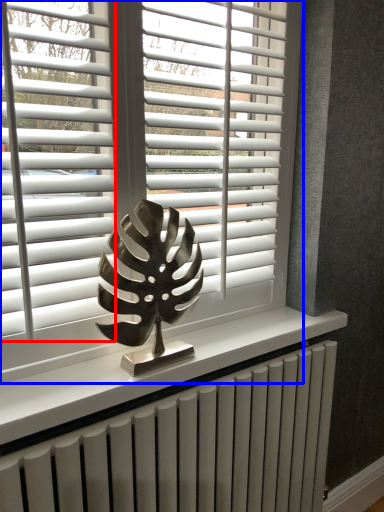
Question: Among these objects, which one is nearest to the camera, blind (highlighted by a red box) or window blind (highlighted by a blue box)?

Choices:
 (A) blind
 (B) window blind

Answer: (B)